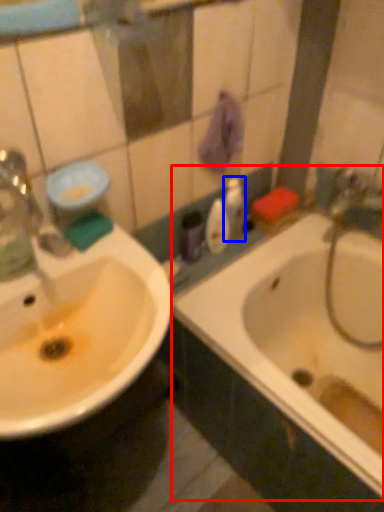
Question: Which object appears closest to the camera in this image, bathtub (highlighted by a red box) or toiletry (highlighted by a blue box)?

Choices:
 (A) bathtub
 (B) toiletry

Answer: (A)